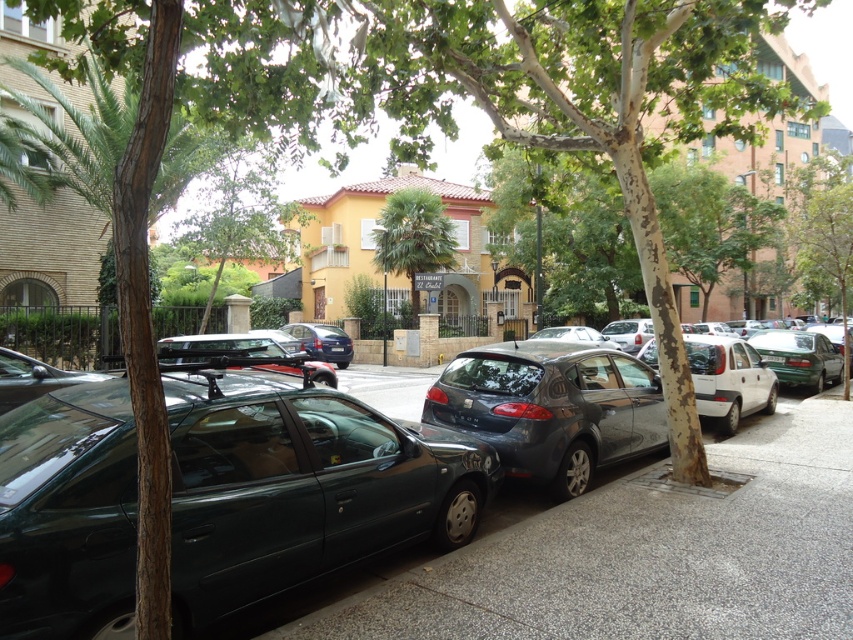
Question: Is green leafy tree at upper center closer to the viewer compared to shiny blue sedan at center?

Choices:
 (A) yes
 (B) no

Answer: (A)

Question: Which object is the closest to the shiny black sedan at center?

Choices:
 (A) shiny blue sedan at center
 (B) metallic gray hatchback at center
 (C) green leafy palm tree at center

Answer: (B)

Question: From the image, what is the correct spatial relationship of gray concrete pavement at center in relation to green leafy tree at upper center?

Choices:
 (A) above
 (B) below

Answer: (B)

Question: Can you confirm if green leafy tree at upper center is smaller than green leafy palm tree at center?

Choices:
 (A) yes
 (B) no

Answer: (B)

Question: Which point appears farthest from the camera in this image?

Choices:
 (A) (268, 461)
 (B) (589, 458)

Answer: (B)

Question: Which object is the farthest from the green leafy tree at upper center?

Choices:
 (A) shiny blue sedan at center
 (B) metallic gray hatchback at center

Answer: (B)